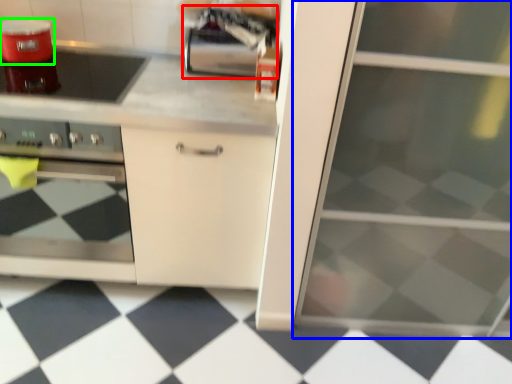
Question: Which object is positioned farthest from appliance (highlighted by a red box)? Select from screen door (highlighted by a blue box) and kitchen appliance (highlighted by a green box).

Choices:
 (A) screen door
 (B) kitchen appliance

Answer: (A)